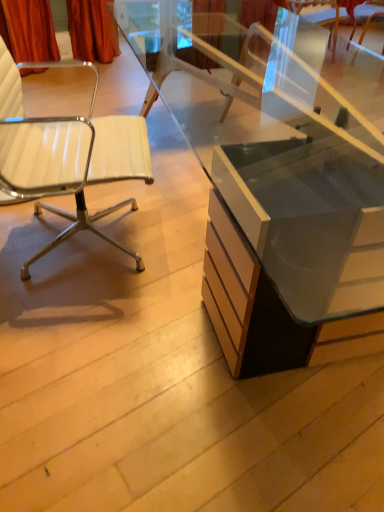
Question: From the image's perspective, is white leather chair at upper right, acting as the 1th chair starting from the top, located beneath matte glass desk at center?

Choices:
 (A) no
 (B) yes

Answer: (A)

Question: Is white leather chair at upper right, which is the 2th chair in bottom-to-top order, not close to matte glass desk at center?

Choices:
 (A) no
 (B) yes

Answer: (B)

Question: Does white leather chair at upper right, which is the 2th chair in bottom-to-top order, have a lesser width compared to matte glass desk at center?

Choices:
 (A) no
 (B) yes

Answer: (B)

Question: Does white leather chair at upper right, arranged as the 2th chair when viewed from the left, touch matte glass desk at center?

Choices:
 (A) no
 (B) yes

Answer: (A)

Question: From the image's perspective, is white leather chair at upper right, acting as the first chair starting from the back, on top of matte glass desk at center?

Choices:
 (A) no
 (B) yes

Answer: (B)

Question: Does white leather chair at upper right, which is the 2th chair in bottom-to-top order, have a greater width compared to matte glass desk at center?

Choices:
 (A) yes
 (B) no

Answer: (B)

Question: Is white leather chair at left, which ranks as the 2th chair in back-to-front order, behind white leather chair at upper right, acting as the first chair starting from the back?

Choices:
 (A) yes
 (B) no

Answer: (B)

Question: Does white leather chair at left, marked as the first chair in a front-to-back arrangement, lie in front of white leather chair at upper right, marked as the second chair in a front-to-back arrangement?

Choices:
 (A) yes
 (B) no

Answer: (A)

Question: Is white leather chair at left, which ranks as the second chair in top-to-bottom order, to the right of white leather chair at upper right, arranged as the first chair when viewed from the right, from the viewer's perspective?

Choices:
 (A) yes
 (B) no

Answer: (B)

Question: Could white leather chair at upper right, arranged as the 2th chair when viewed from the left, be considered to be inside white leather chair at left, the 2th chair in the right-to-left sequence?

Choices:
 (A) no
 (B) yes

Answer: (A)

Question: Does white leather chair at left, which ranks as the first chair in bottom-to-top order, have a lesser width compared to white leather chair at upper right, acting as the first chair starting from the back?

Choices:
 (A) yes
 (B) no

Answer: (B)

Question: From a real-world perspective, is white leather chair at left, marked as the first chair in a front-to-back arrangement, located beneath white leather chair at upper right, acting as the first chair starting from the back?

Choices:
 (A) yes
 (B) no

Answer: (B)

Question: From a real-world perspective, is white leather chair at upper right, arranged as the first chair when viewed from the right, on white leather chair at left, marked as the first chair in a front-to-back arrangement?

Choices:
 (A) yes
 (B) no

Answer: (B)